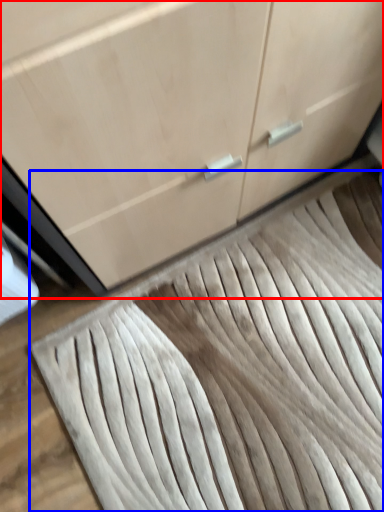
Question: Which object is closer to the camera taking this photo, cabinetry (highlighted by a red box) or doormat (highlighted by a blue box)?

Choices:
 (A) cabinetry
 (B) doormat

Answer: (A)